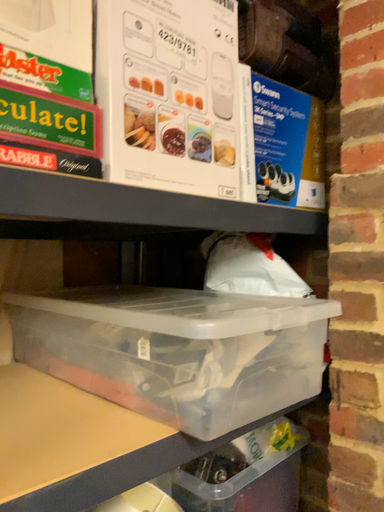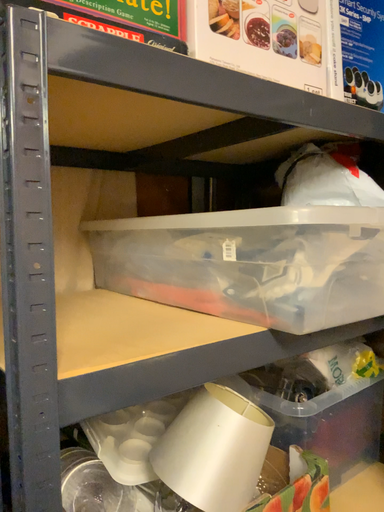
Question: Which way did the camera rotate in the video?

Choices:
 (A) rotated right
 (B) rotated left

Answer: (B)